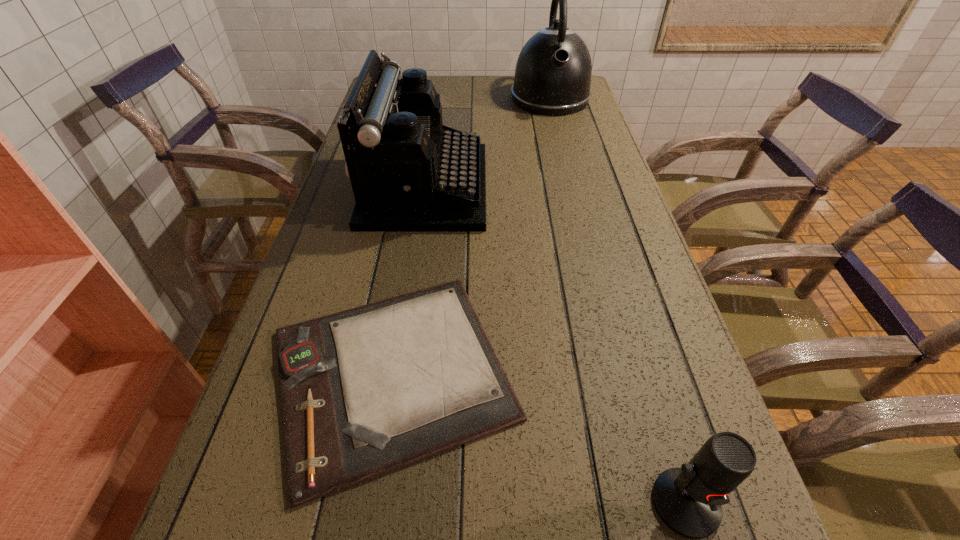
The image size is (960, 540). What are the coordinates of `vacant space in between the typewriter and the farthest object` in the screenshot? It's located at (488, 143).

Where is `vacant area that lies between the clipboard and the farthest object`? This screenshot has height=540, width=960. vacant area that lies between the clipboard and the farthest object is located at coordinates (471, 235).

The image size is (960, 540). Identify the location of blank region between the shortest object and the typewriter. (409, 280).

Image resolution: width=960 pixels, height=540 pixels. I want to click on free space between the microphone and the third nearest object, so click(x=555, y=345).

Locate an element on the screen. The height and width of the screenshot is (540, 960). vacant area that lies between the farthest object and the typewriter is located at coordinates coord(488,143).

You are a GUI agent. You are given a task and a screenshot of the screen. Output one action in this format:
    pyautogui.click(x=<x>, y=<y>)
    Task: Click on the blank region between the typewriter and the shortest object
    The image size is (960, 540).
    Given the screenshot: What is the action you would take?
    pyautogui.click(x=409, y=280)

Where is `the third closest object to the kettle`? The height and width of the screenshot is (540, 960). the third closest object to the kettle is located at coordinates (688, 499).

Find the location of a particular element. object that is the closest to the third nearest object is located at coordinates (365, 391).

This screenshot has height=540, width=960. In order to click on vacant point that satisfies the following two spatial constraints: 1. on the spout of the farthest object; 2. on the typing side of the second farthest object in this screenshot , I will do `click(572, 187)`.

Where is `free space that satisfies the following two spatial constraints: 1. on the spout of the farthest object; 2. on the typing side of the typewriter`? This screenshot has width=960, height=540. free space that satisfies the following two spatial constraints: 1. on the spout of the farthest object; 2. on the typing side of the typewriter is located at coordinates (572, 187).